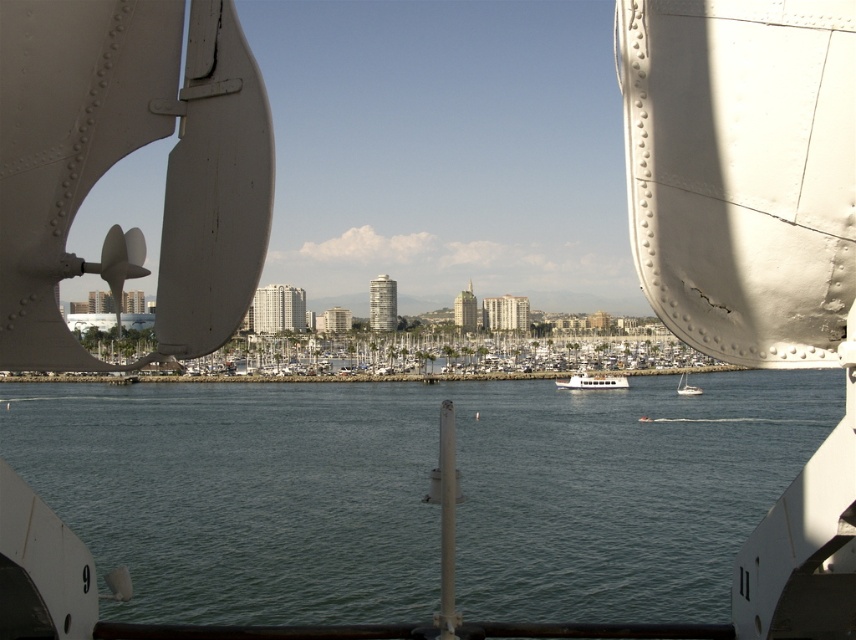
Which is more to the left, greenish-blue water at center or white matte sailboat at lower right?

Positioned to the left is greenish-blue water at center.

Does greenish-blue water at center have a smaller size compared to white matte sailboat at lower right?

No, greenish-blue water at center is not smaller than white matte sailboat at lower right.

Is point (628, 616) more distant than point (687, 388)?

No.

Locate an element on the screen. This screenshot has width=856, height=640. greenish-blue water at center is located at coordinates (417, 492).

Between white metallic propeller at center and white matte sailboat at lower right, which one appears on the right side from the viewer's perspective?

From the viewer's perspective, white matte sailboat at lower right appears more on the right side.

Which is behind, point (206, 300) or point (690, 385)?

Point (690, 385)

At what (x,y) coordinates should I click in order to perform the action: click on white metallic propeller at center. Please return your answer as a coordinate pair (x, y). Looking at the image, I should click on (123, 156).

I want to click on white metallic propeller at center, so click(x=123, y=156).

Can you confirm if white metallic propeller at center is positioned to the right of white glossy boat at center?

In fact, white metallic propeller at center is to the left of white glossy boat at center.

Who is positioned more to the left, white metallic propeller at center or white glossy boat at center?

white metallic propeller at center is more to the left.

Is point (194, 65) farther from viewer compared to point (556, 384)?

That is False.

You are a GUI agent. You are given a task and a screenshot of the screen. Output one action in this format:
    pyautogui.click(x=<x>, y=<y>)
    Task: Click on the white metallic propeller at center
    
    Given the screenshot: What is the action you would take?
    pyautogui.click(x=123, y=156)